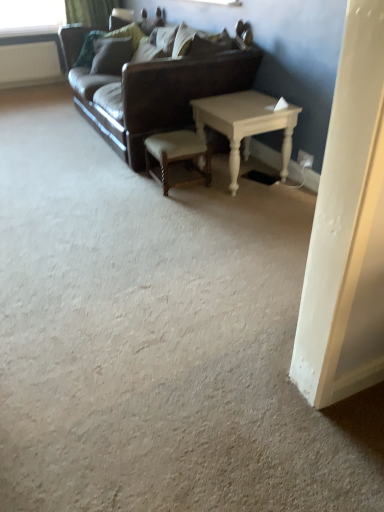
Find the location of a particular element. free point above wooden polished stool at center (from a real-world perspective) is located at coordinates (167, 136).